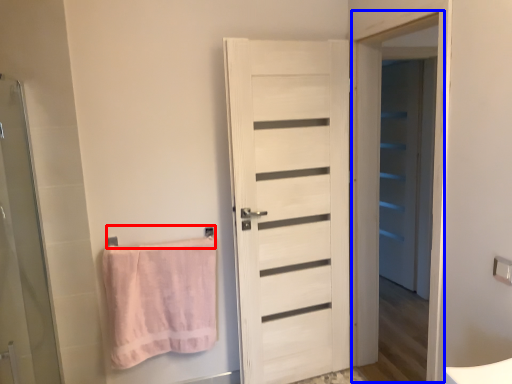
Question: Among these objects, which one is nearest to the camera, towel bar (highlighted by a red box) or screen door (highlighted by a blue box)?

Choices:
 (A) towel bar
 (B) screen door

Answer: (B)